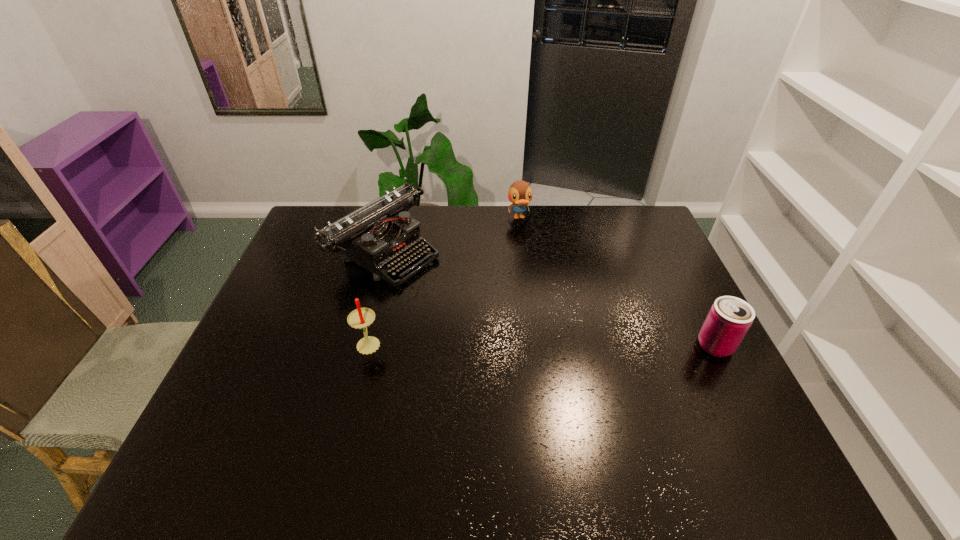
At what (x,y) coordinates should I click in order to perform the action: click on candle. Please return your answer as a coordinate pair (x, y). The image size is (960, 540). Looking at the image, I should click on (360, 318).

At what (x,y) coordinates should I click in order to perform the action: click on the rightmost object. Please return your answer as a coordinate pair (x, y). Looking at the image, I should click on (729, 319).

This screenshot has height=540, width=960. I want to click on the third object from left to right, so click(x=520, y=194).

Locate an element on the screen. This screenshot has width=960, height=540. typewriter is located at coordinates pos(379,235).

Locate an element on the screen. free space located 0.280m on the right of the candle is located at coordinates (486, 343).

Locate an element on the screen. free space located on the left of the can is located at coordinates (547, 346).

Locate an element on the screen. vacant space situated 0.190m on the front-facing side of the second object from right to left is located at coordinates 532,260.

Locate an element on the screen. The image size is (960, 540). vacant area situated 0.150m on the front-facing side of the second object from right to left is located at coordinates (529, 252).

This screenshot has height=540, width=960. Identify the location of free space located on the front-facing side of the second object from right to left. (545, 303).

Find the location of `blank space located 0.210m on the keyboard of the typewriter`. blank space located 0.210m on the keyboard of the typewriter is located at coordinates (478, 304).